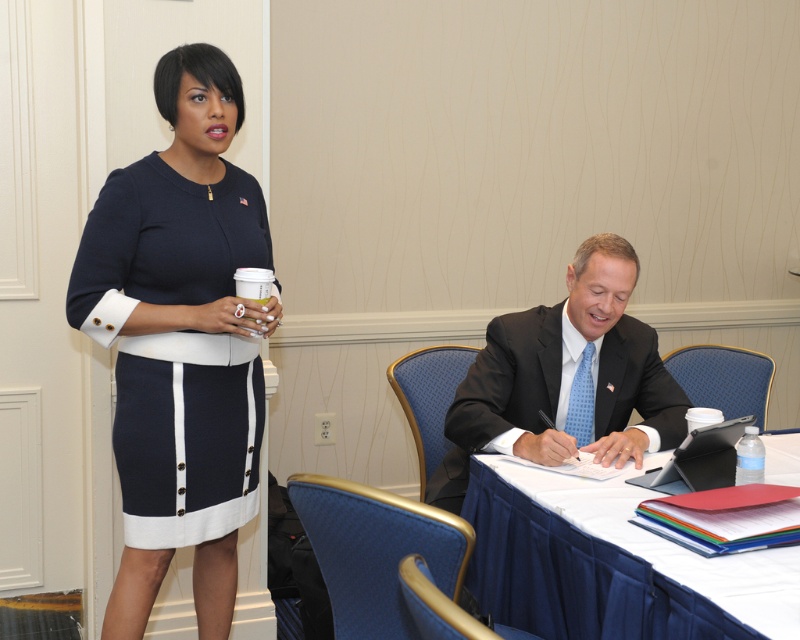
You are standing in the conference room and need to determine which of the two points, point (270, 250) or point (616, 348), is closer to you. Based on the scene, which point is nearer?

Point (270, 250) is closer to the viewer than point (616, 348).

What object is located at the coordinate point [186,435] in the image?

The navy knit dress at upper left is located at the coordinate point [186,435].